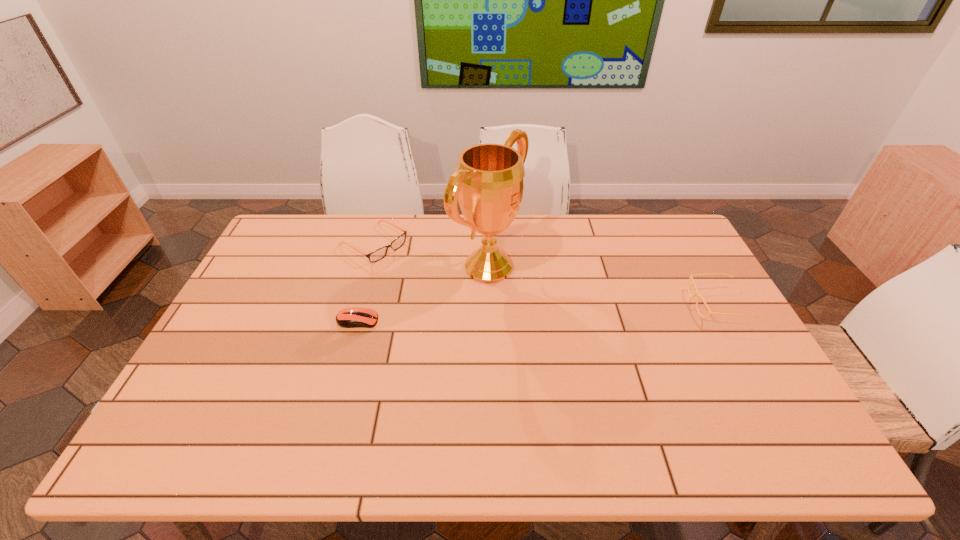
Where is `free space on the desktop that is between the shortest object and the rightmost object and is positioned on the front-facing side of the farther spectacles`? This screenshot has width=960, height=540. free space on the desktop that is between the shortest object and the rightmost object and is positioned on the front-facing side of the farther spectacles is located at coordinates (487, 315).

Image resolution: width=960 pixels, height=540 pixels. In order to click on vacant space on the desktop that is between the shortest object and the rightmost object and is positioned on the front-facing side of the award in this screenshot , I will do `click(592, 310)`.